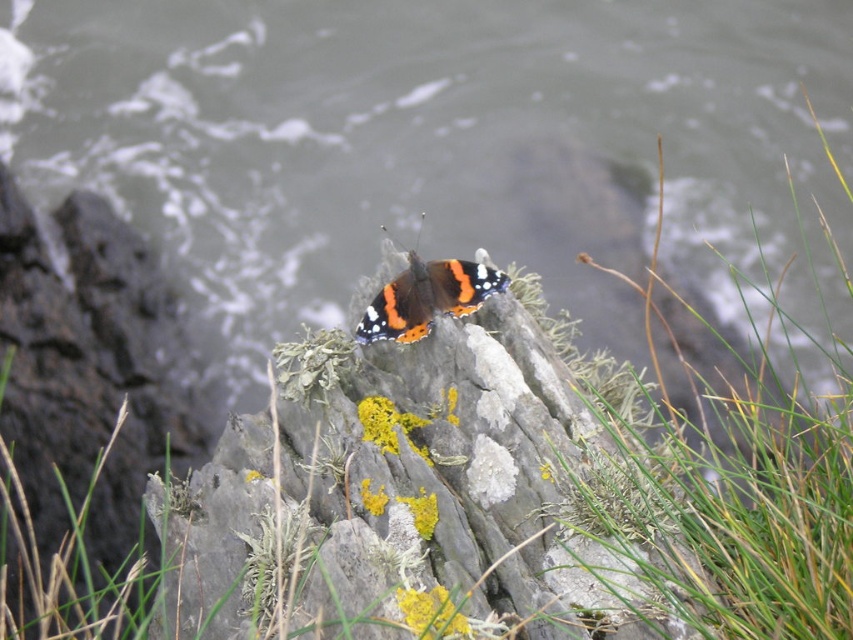
Question: Is gray rough rock at center to the right of shiny orange butterfly at center from the viewer's perspective?

Choices:
 (A) yes
 (B) no

Answer: (B)

Question: Which object is closer to the camera taking this photo?

Choices:
 (A) lichen-covered rock at center
 (B) gray rough rock at center
 (C) shiny orange butterfly at center

Answer: (A)

Question: Which object is farther from the camera taking this photo?

Choices:
 (A) shiny orange butterfly at center
 (B) gray rough rock at center
 (C) lichen-covered rock at center

Answer: (B)

Question: Is the position of lichen-covered rock at center more distant than that of shiny orange butterfly at center?

Choices:
 (A) yes
 (B) no

Answer: (B)

Question: Which object appears closest to the camera in this image?

Choices:
 (A) shiny orange butterfly at center
 (B) lichen-covered rock at center
 (C) gray rough rock at center

Answer: (B)

Question: Does lichen-covered rock at center appear on the left side of gray rough rock at center?

Choices:
 (A) yes
 (B) no

Answer: (B)